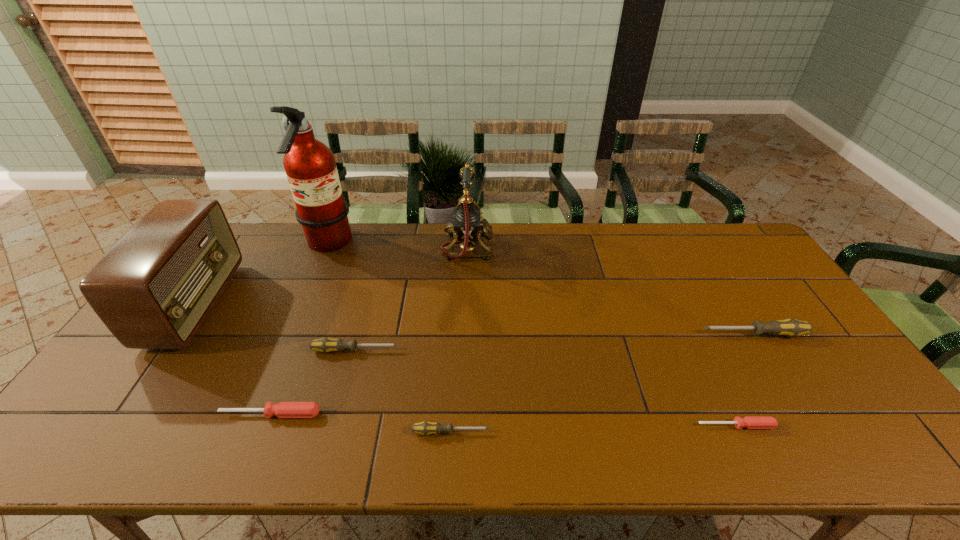
I want to click on the nearest gray screwdriver, so click(x=425, y=428).

Locate an element on the screen. This screenshot has height=540, width=960. the smaller red screwdriver is located at coordinates [x=750, y=422].

I want to click on the right red screwdriver, so click(750, 422).

You are a GUI agent. You are given a task and a screenshot of the screen. Output one action in this format:
    pyautogui.click(x=<x>, y=<y>)
    Task: Click on the free space located on the nozzle and handle of the tallest object
    This screenshot has height=540, width=960.
    Given the screenshot: What is the action you would take?
    tap(429, 245)

At what (x,y) coordinates should I click in order to perform the action: click on blank space located 0.300m on the front of the black telephone, featuring the rotary dial. Please return your answer as a coordinate pair (x, y). Looking at the image, I should click on (579, 247).

Identify the location of blank space located 0.070m on the front-facing side of the leftmost object. (245, 305).

I want to click on vacant space located at the tip of the biggest gray screwdriver, so tap(665, 334).

In order to click on vacant region located 0.170m at the tip of the biggest gray screwdriver in this screenshot , I will do `click(640, 334)`.

At what (x,y) coordinates should I click in order to perform the action: click on vacant space situated 0.340m at the tip of the biggest gray screwdriver. Please return your answer as a coordinate pair (x, y). Looking at the image, I should click on (580, 334).

The image size is (960, 540). I want to click on vacant region located at the tip of the fifth tallest object, so click(506, 350).